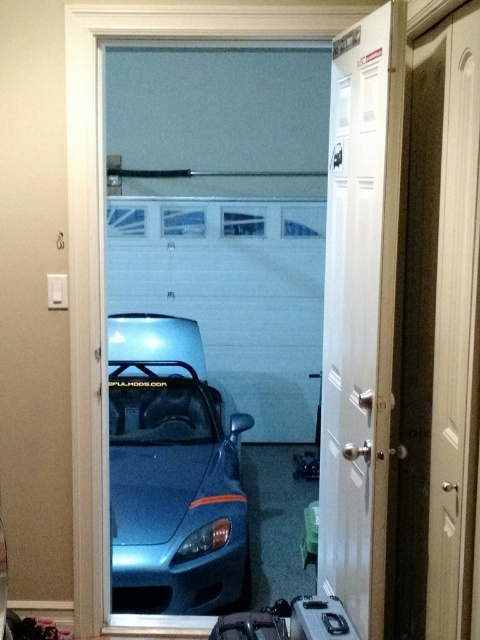
From the picture: You are standing in front of the garage and want to open the white glossy door at center. Based on its position, where should you aim your hand to grasp the doorknob?

The white glossy door at center is positioned at point 0.491 on the horizontal axis and 0.750 on the vertical axis. To grasp the doorknob, aim for the center area of the door where the doorknob is typically located.

You are a delivery person trying to reach the matte black suitcase at lower center in the garage. The satin blue car at center is blocking your path. Can you walk around the car to access the suitcase?

The matte black suitcase at lower center is behind the satin blue car at center, so you cannot access it by walking around the car since the car is blocking the path to the suitcase.